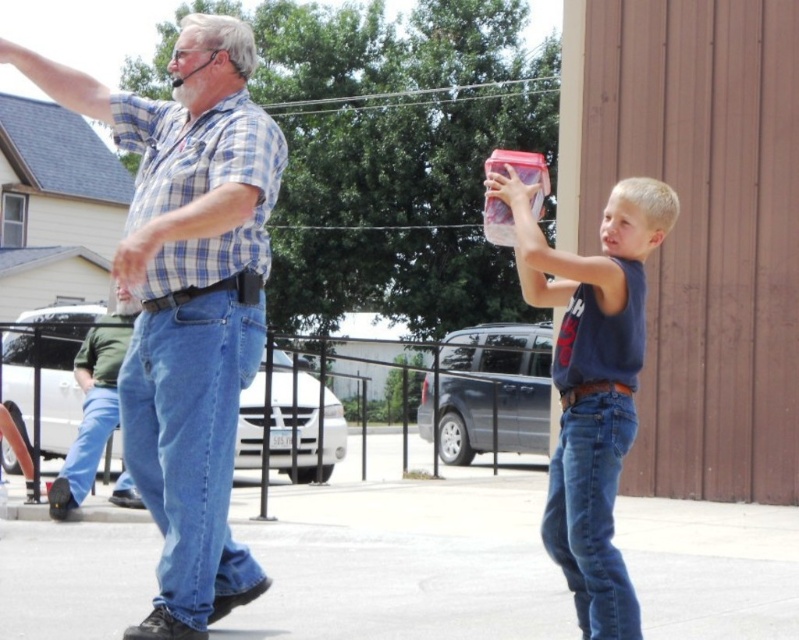
Between point (173, 148) and point (573, 465), which one is positioned behind?

Point (173, 148)

You are a GUI agent. You are given a task and a screenshot of the screen. Output one action in this format:
    pyautogui.click(x=<x>, y=<y>)
    Task: Click on the blue plaid shirt at upper left
    This screenshot has width=799, height=640.
    Given the screenshot: What is the action you would take?
    pyautogui.click(x=189, y=300)

Is matte plastic container at center to the right of green cotton shirt at left from the viewer's perspective?

Correct, you'll find matte plastic container at center to the right of green cotton shirt at left.

From the picture: Is matte plastic container at center closer to the viewer compared to green cotton shirt at left?

Yes, it is in front of green cotton shirt at left.

Does point (613, 458) come farther from viewer compared to point (86, 420)?

No.

The image size is (799, 640). What are the coordinates of `matte plastic container at center` in the screenshot? It's located at (591, 384).

From the picture: Which is more to the left, blue plaid shirt at upper left or green cotton shirt at left?

From the viewer's perspective, green cotton shirt at left appears more on the left side.

Is point (193, 360) positioned after point (106, 330)?

No, it is not.

I want to click on blue plaid shirt at upper left, so click(x=189, y=300).